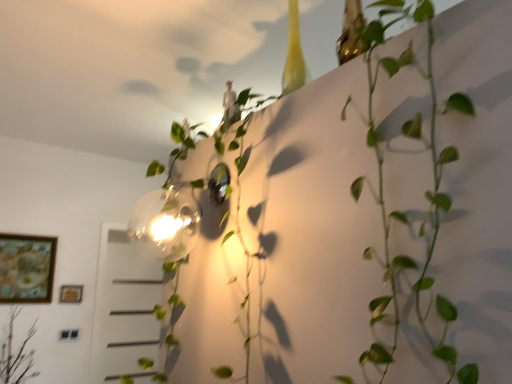
Question: Is gold metallic picture frame at lower left, which is the 2th picture frame in left-to-right order, thinner than green matte plant at upper right, the first plant viewed from the front?

Choices:
 (A) yes
 (B) no

Answer: (A)

Question: Does gold metallic picture frame at lower left, which is the 2th picture frame in left-to-right order, have a lesser height compared to green matte plant at upper right, the first plant from the right?

Choices:
 (A) no
 (B) yes

Answer: (B)

Question: Is green matte plant at upper right, the first plant viewed from the front, surrounded by gold metallic picture frame at lower left, marked as the 1th picture frame in a right-to-left arrangement?

Choices:
 (A) no
 (B) yes

Answer: (A)

Question: Can you confirm if gold metallic picture frame at lower left, which is the 2th picture frame in left-to-right order, is smaller than green matte plant at upper right, the first plant from the right?

Choices:
 (A) no
 (B) yes

Answer: (B)

Question: From a real-world perspective, does gold metallic picture frame at lower left, which is the 2th picture frame in left-to-right order, sit lower than green matte plant at upper right, marked as the 3th plant in a left-to-right arrangement?

Choices:
 (A) no
 (B) yes

Answer: (B)

Question: From the image's perspective, is gold metallic picture frame at lower left, which is the 2th picture frame in left-to-right order, over green matte plant at upper right, the first plant viewed from the front?

Choices:
 (A) no
 (B) yes

Answer: (A)

Question: Is gold metallic picture frame at lower left, which is the 2th picture frame in left-to-right order, inside green leafy plant at upper center, the 2th plant positioned from the front?

Choices:
 (A) yes
 (B) no

Answer: (B)

Question: Considering the relative positions of green leafy plant at upper center, the second plant positioned from the right, and gold metallic picture frame at lower left, which is the 2th picture frame in left-to-right order, in the image provided, is green leafy plant at upper center, the second plant positioned from the right, behind gold metallic picture frame at lower left, which is the 2th picture frame in left-to-right order,?

Choices:
 (A) yes
 (B) no

Answer: (B)

Question: Is green leafy plant at upper center, marked as the second plant in a back-to-front arrangement, not close to gold metallic picture frame at lower left, which is the 2th picture frame in left-to-right order?

Choices:
 (A) yes
 (B) no

Answer: (A)

Question: From a real-world perspective, is green leafy plant at upper center, the 2th plant positioned from the front, under gold metallic picture frame at lower left, marked as the 1th picture frame in a right-to-left arrangement?

Choices:
 (A) no
 (B) yes

Answer: (A)

Question: Does green leafy plant at upper center, the 2th plant positioned from the front, turn towards gold metallic picture frame at lower left, marked as the 1th picture frame in a right-to-left arrangement?

Choices:
 (A) no
 (B) yes

Answer: (A)

Question: Is green leafy plant at upper center, marked as the second plant in a back-to-front arrangement, thinner than gold metallic picture frame at lower left, marked as the 1th picture frame in a right-to-left arrangement?

Choices:
 (A) no
 (B) yes

Answer: (A)

Question: Considering the relative sizes of green leafy plant at upper center, the 2th plant positioned from the front, and wooden framed artwork at lower left, placed as the 2th picture frame when sorted from right to left, in the image provided, is green leafy plant at upper center, the 2th plant positioned from the front, wider than wooden framed artwork at lower left, placed as the 2th picture frame when sorted from right to left,?

Choices:
 (A) yes
 (B) no

Answer: (A)